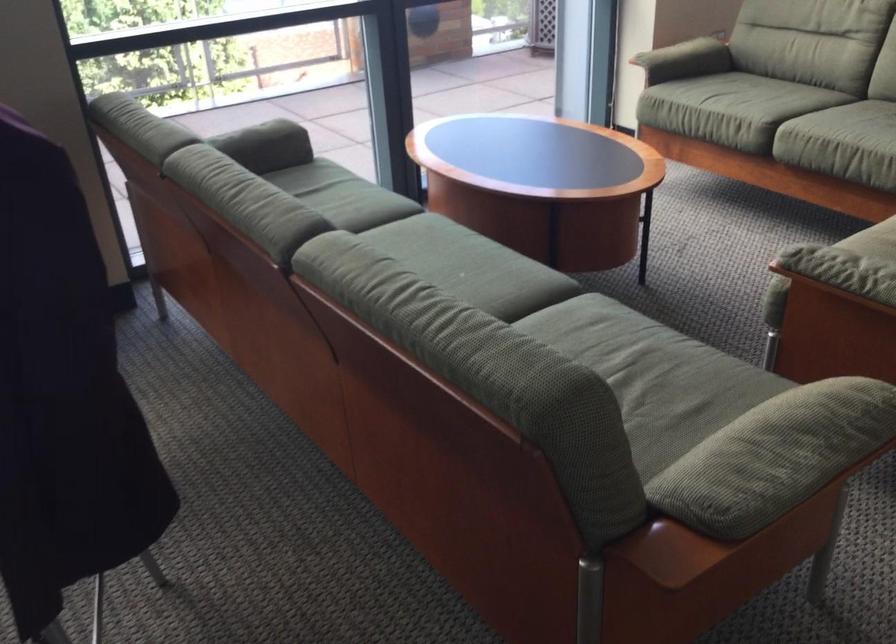
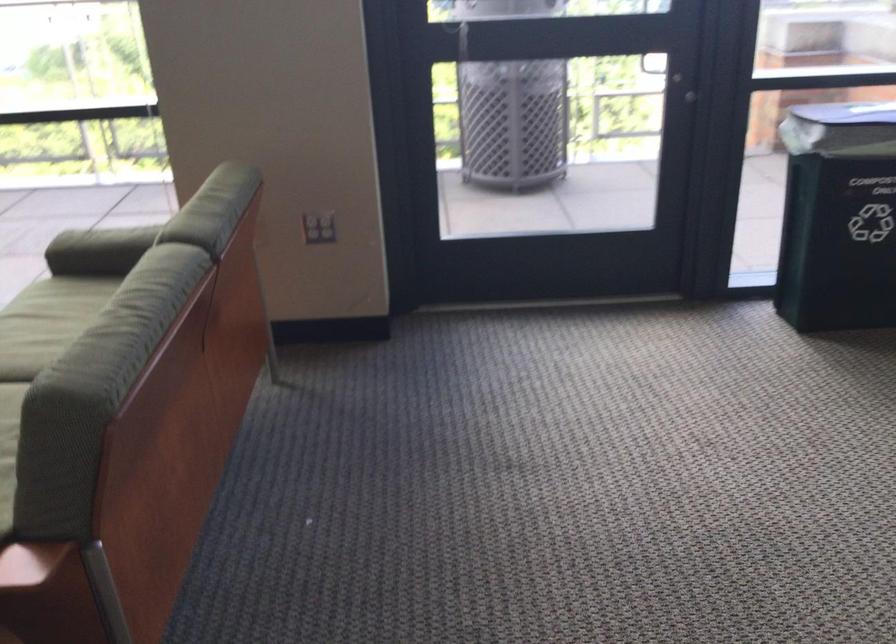
Find the pixel in the second image that matches (x=742, y=100) in the first image.

(46, 323)